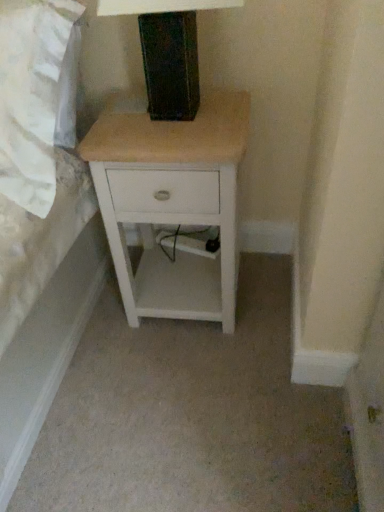
Find the location of a particular element. The image size is (384, 512). free location to the left of white wood nightstand at center is located at coordinates click(x=100, y=333).